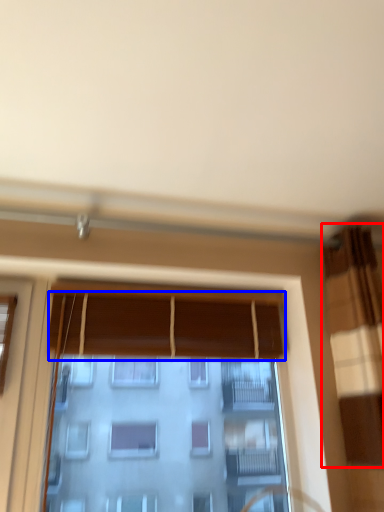
Question: Among these objects, which one is nearest to the camera, curtain (highlighted by a red box) or curtain (highlighted by a blue box)?

Choices:
 (A) curtain
 (B) curtain

Answer: (A)